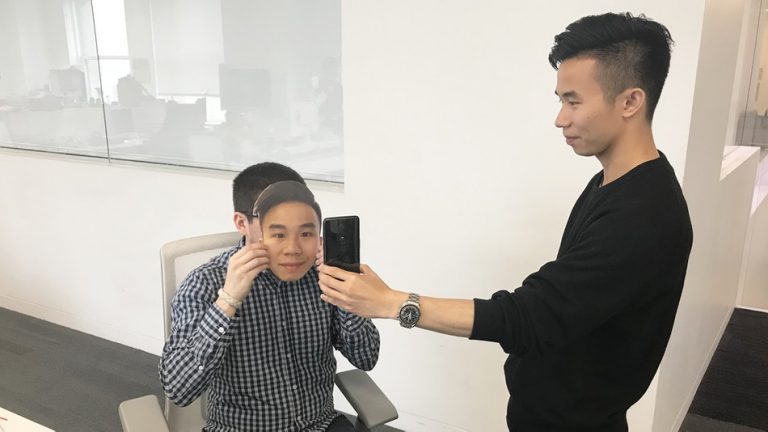
Find the location of a particular element. This screenshot has height=432, width=768. chair is located at coordinates (366, 387).